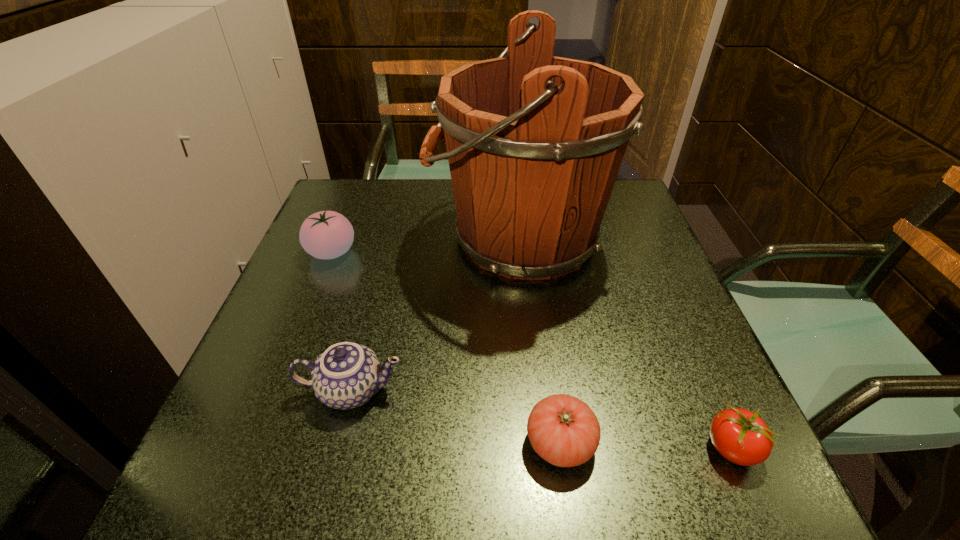
Where is `vacant space at the far edge of the desktop`? Image resolution: width=960 pixels, height=540 pixels. vacant space at the far edge of the desktop is located at coordinates (437, 214).

Locate an element on the screen. blank area at the near edge is located at coordinates (535, 474).

The image size is (960, 540). Find the location of `free space at the left edge of the desktop`. free space at the left edge of the desktop is located at coordinates (359, 240).

In the image, there is a desktop. Where is `vacant space at the right edge`? This screenshot has width=960, height=540. vacant space at the right edge is located at coordinates (647, 333).

You are a GUI agent. You are given a task and a screenshot of the screen. Output one action in this format:
    pyautogui.click(x=<x>, y=<y>)
    Task: Click on the vacant area at the near right corner of the desktop
    The width and height of the screenshot is (960, 540).
    Given the screenshot: What is the action you would take?
    pyautogui.click(x=680, y=498)

This screenshot has height=540, width=960. In order to click on blank region between the leftmost tomato and the rightmost tomato in this screenshot , I will do `click(531, 350)`.

Identify the location of free space between the second tomato from left to right and the tallest object. (540, 340).

The width and height of the screenshot is (960, 540). What are the coordinates of `vacant area that lies between the second tomato from right to left and the farthest tomato` in the screenshot? It's located at (446, 347).

This screenshot has height=540, width=960. In order to click on empty space that is in between the chinaware and the second tomato from right to left in this screenshot , I will do `click(456, 416)`.

This screenshot has width=960, height=540. I want to click on free space between the chinaware and the tallest object, so click(x=435, y=314).